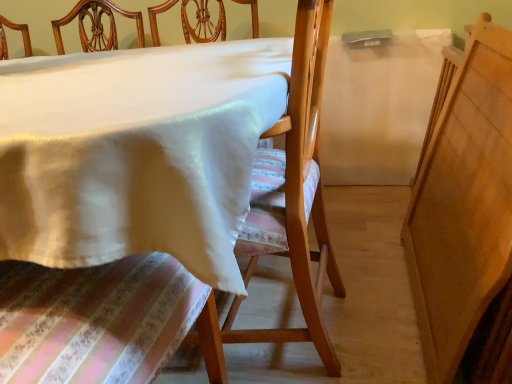
Question: From a real-world perspective, is white glossy table at center on top of wooden chair at center?

Choices:
 (A) yes
 (B) no

Answer: (B)

Question: Can you confirm if white glossy table at center is thinner than wooden chair at center?

Choices:
 (A) no
 (B) yes

Answer: (A)

Question: From the image's perspective, would you say white glossy table at center is positioned over wooden chair at center?

Choices:
 (A) no
 (B) yes

Answer: (A)

Question: Is wooden chair at center at the back of white glossy table at center?

Choices:
 (A) no
 (B) yes

Answer: (A)

Question: Considering the relative positions of white glossy table at center and wooden chair at center in the image provided, is white glossy table at center to the left of wooden chair at center from the viewer's perspective?

Choices:
 (A) no
 (B) yes

Answer: (B)

Question: Is wooden chair at center completely or partially inside white glossy table at center?

Choices:
 (A) yes
 (B) no

Answer: (A)

Question: Can you confirm if wooden chair at center is taller than white glossy table at center?

Choices:
 (A) yes
 (B) no

Answer: (A)

Question: Could you tell me if wooden chair at center is facing white glossy table at center?

Choices:
 (A) yes
 (B) no

Answer: (A)

Question: Is wooden chair at center positioned behind white glossy table at center?

Choices:
 (A) yes
 (B) no

Answer: (A)

Question: Is wooden chair at center positioned with its back to white glossy table at center?

Choices:
 (A) no
 (B) yes

Answer: (B)

Question: Is wooden chair at center directly adjacent to white glossy table at center?

Choices:
 (A) yes
 (B) no

Answer: (B)

Question: Does wooden chair at center have a lesser width compared to white glossy table at center?

Choices:
 (A) no
 (B) yes

Answer: (B)

Question: Considering the positions of wooden chair at center and white glossy table at center in the image, is wooden chair at center bigger or smaller than white glossy table at center?

Choices:
 (A) small
 (B) big

Answer: (A)